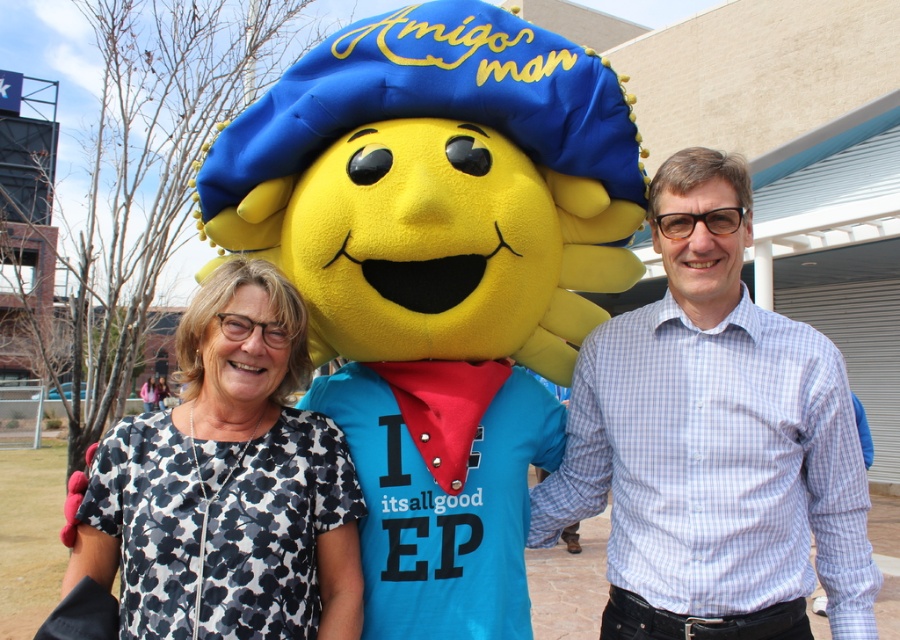
You are a photographer setting up for a group photo. You need to position yourself so that both the white checkered shirt at center and the white dotted shirt at center are in your frame. Which shirt should you focus on first to ensure both are in focus?

You should focus on the white checkered shirt at center first since it is closer to you than the white dotted shirt at center, ensuring both are in focus by starting with the closer subject.

Based on the scene description, which object is taller between the matte yellow head at center and the white dotted shirt at center?

The matte yellow head at center is taller than the white dotted shirt at center.

You are a photographer trying to capture the scene with a camera that has a limited depth of field. You want to focus on both points mentioned. Given that point A is at point (488, 512) and point B is at point (681, 532), which point is closer to the camera, and will both points be in focus if the depth of field can only accommodate objects within a certain distance range?

Point A at (488, 512) is closer to the camera than point B at (681, 532). However, since the depth of field can only accommodate objects within a certain distance range, if the difference in distance between the two points exceeds the depth of field range, both points may not be in focus simultaneously. To ensure both are in focus, adjust the camera settings or move closer to minimize the distance difference.